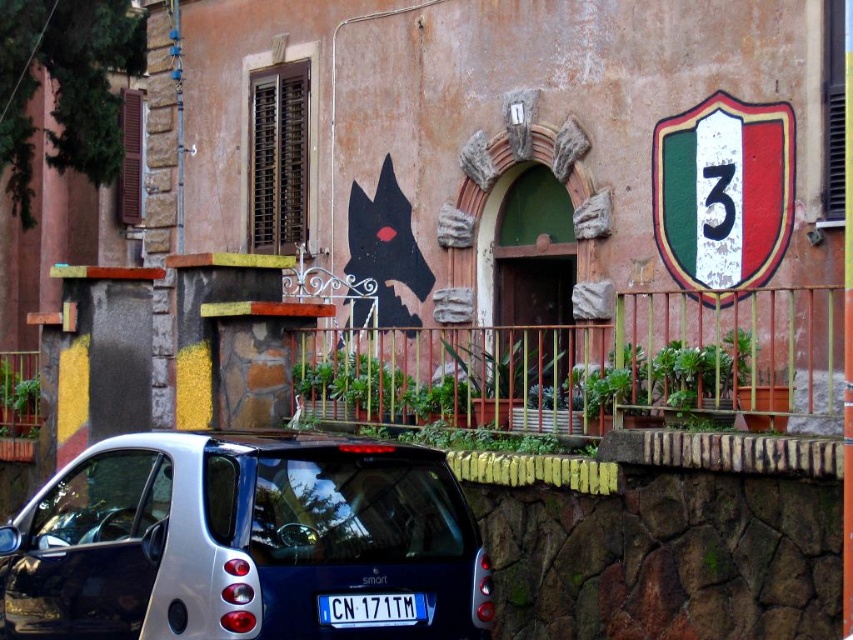
Question: Can you confirm if metallic blue car at lower left is positioned below white plastic license plate at center?

Choices:
 (A) yes
 (B) no

Answer: (B)

Question: Which point is farther from the camera taking this photo?

Choices:
 (A) (207, 564)
 (B) (386, 621)
 (C) (711, 236)

Answer: (C)

Question: Which point is closer to the camera?

Choices:
 (A) pyautogui.click(x=349, y=624)
 (B) pyautogui.click(x=163, y=531)
 (C) pyautogui.click(x=740, y=289)

Answer: (A)

Question: In this image, where is metallic blue car at lower left located relative to white plastic license plate at center?

Choices:
 (A) below
 (B) above

Answer: (B)

Question: Observing the image, what is the correct spatial positioning of painted metal shield at upper right in reference to white plastic license plate at center?

Choices:
 (A) left
 (B) right

Answer: (B)

Question: Which object is the closest to the white plastic license plate at center?

Choices:
 (A) metallic blue car at lower left
 (B) painted metal shield at upper right

Answer: (A)